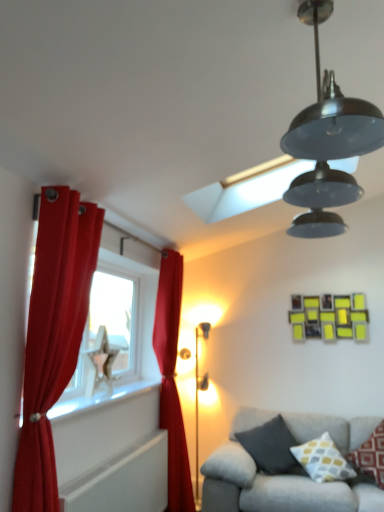
Question: Should I look upward or downward to see gray fabric couch at lower right?

Choices:
 (A) up
 (B) down

Answer: (B)

Question: Is white glossy window sill at lower left smaller than yellow and gray patterned pillow at lower right, arranged as the 2th pillow when viewed from the left?

Choices:
 (A) yes
 (B) no

Answer: (A)

Question: Can you confirm if white glossy window sill at lower left is positioned to the left of yellow and gray patterned pillow at lower right, marked as the 2th pillow in a right-to-left arrangement?

Choices:
 (A) yes
 (B) no

Answer: (A)

Question: Can you confirm if white glossy window sill at lower left is bigger than yellow and gray patterned pillow at lower right, marked as the 2th pillow in a right-to-left arrangement?

Choices:
 (A) yes
 (B) no

Answer: (B)

Question: From a real-world perspective, is white glossy window sill at lower left located beneath yellow and gray patterned pillow at lower right, arranged as the 2th pillow when viewed from the left?

Choices:
 (A) no
 (B) yes

Answer: (A)

Question: Considering the relative sizes of white glossy window sill at lower left and yellow and gray patterned pillow at lower right, arranged as the 2th pillow when viewed from the left, in the image provided, is white glossy window sill at lower left taller than yellow and gray patterned pillow at lower right, arranged as the 2th pillow when viewed from the left,?

Choices:
 (A) yes
 (B) no

Answer: (B)

Question: From a real-world perspective, is white glossy window sill at lower left physically above yellow and gray patterned pillow at lower right, marked as the 2th pillow in a right-to-left arrangement?

Choices:
 (A) no
 (B) yes

Answer: (B)

Question: Is yellow and gray patterned pillow at lower right, arranged as the 2th pillow when viewed from the left, positioned with its back to gray fabric couch at lower right?

Choices:
 (A) yes
 (B) no

Answer: (A)

Question: Does yellow and gray patterned pillow at lower right, marked as the 2th pillow in a right-to-left arrangement, appear on the right side of gray fabric couch at lower right?

Choices:
 (A) no
 (B) yes

Answer: (B)

Question: From a real-world perspective, is yellow and gray patterned pillow at lower right, arranged as the 2th pillow when viewed from the left, physically below gray fabric couch at lower right?

Choices:
 (A) yes
 (B) no

Answer: (B)

Question: Would you say gray fabric couch at lower right is part of yellow and gray patterned pillow at lower right, marked as the 2th pillow in a right-to-left arrangement,'s contents?

Choices:
 (A) no
 (B) yes

Answer: (A)

Question: Is yellow and gray patterned pillow at lower right, arranged as the 2th pillow when viewed from the left, not inside gray fabric couch at lower right?

Choices:
 (A) yes
 (B) no

Answer: (B)

Question: Considering the relative sizes of yellow and gray patterned pillow at lower right, arranged as the 2th pillow when viewed from the left, and gray fabric couch at lower right in the image provided, is yellow and gray patterned pillow at lower right, arranged as the 2th pillow when viewed from the left, smaller than gray fabric couch at lower right?

Choices:
 (A) no
 (B) yes

Answer: (B)

Question: From the image's perspective, does yellow and gray patterned pillow at lower right, arranged as the 2th pillow when viewed from the left, appear lower than dark gray fabric pillow at lower right, the first pillow from the left?

Choices:
 (A) yes
 (B) no

Answer: (B)